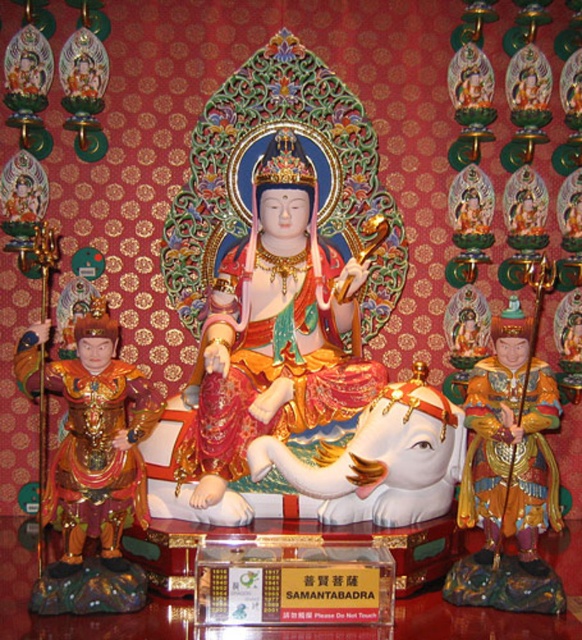
How distant is glossy gold statue at center from gold lacquered statue at left?

3.47 feet

From the picture: Who is higher up, glossy gold statue at center or gold lacquered statue at left?

glossy gold statue at center

What do you see at coordinates (274, 332) in the screenshot? This screenshot has width=582, height=640. I see `glossy gold statue at center` at bounding box center [274, 332].

You are a GUI agent. You are given a task and a screenshot of the screen. Output one action in this format:
    pyautogui.click(x=<x>, y=<y>)
    Task: Click on the glossy gold statue at center
    The height and width of the screenshot is (640, 582).
    Given the screenshot: What is the action you would take?
    pyautogui.click(x=274, y=332)

How much distance is there between gold lacquered statue at left and gold glossy statue at right?

gold lacquered statue at left and gold glossy statue at right are 8.72 feet apart from each other.

Can you confirm if gold lacquered statue at left is smaller than gold glossy statue at right?

Indeed, gold lacquered statue at left has a smaller size compared to gold glossy statue at right.

Does point (83, 352) come in front of point (537, 470)?

Yes, it is.

This screenshot has width=582, height=640. I want to click on gold lacquered statue at left, so click(x=98, y=440).

Is point (205, 426) less distant than point (537, 419)?

That is False.

At what (x,y) coordinates should I click in order to perform the action: click on glossy gold statue at center. Please return your answer as a coordinate pair (x, y). The image size is (582, 640). Looking at the image, I should click on (274, 332).